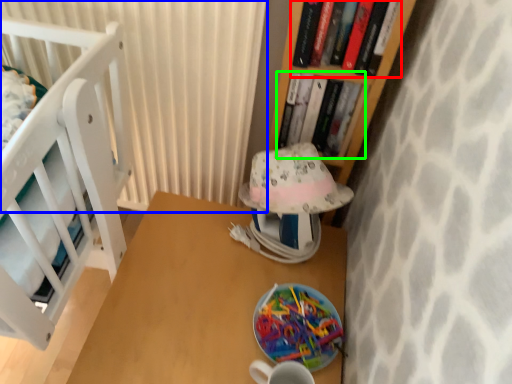
Question: Estimate the real-world distances between objects in this image. Which object is closer to book (highlighted by a red box), curtain (highlighted by a blue box) or book (highlighted by a green box)?

Choices:
 (A) curtain
 (B) book

Answer: (B)